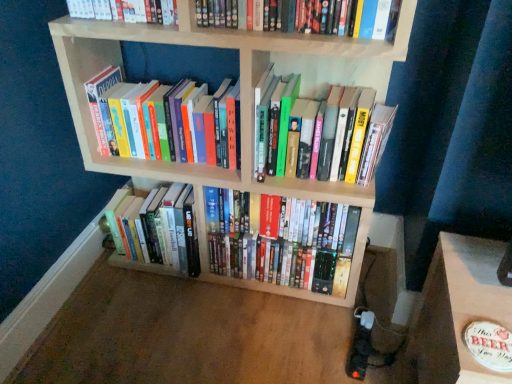
Question: Is hardcover books at left, the 2th book when ordered from top to bottom, inside the boundaries of hardcover book at upper center, placed as the 5th book when sorted from bottom to top, or outside?

Choices:
 (A) inside
 (B) outside

Answer: (B)

Question: In the image, is hardcover books at left, the 2th book when ordered from top to bottom, on the left side or the right side of hardcover book at upper center, the first book when ordered from top to bottom?

Choices:
 (A) right
 (B) left

Answer: (A)

Question: Estimate the real-world distances between objects in this image. Which object is farther from the light wood bookcase at center?

Choices:
 (A) hardcover books at center, the 3th book from the top
 (B) hardcover books at center, the 2th book ordered from the bottom
 (C) hardcover books at left, the 2th book when ordered from top to bottom
 (D) shiny plastic dvds at center, the 1th book positioned from the bottom
 (E) hardcover book at upper center, placed as the 5th book when sorted from bottom to top

Answer: (E)

Question: Estimate the real-world distances between objects in this image. Which object is farther from the light wood bookcase at center?

Choices:
 (A) hardcover books at center, which is counted as the 4th book, starting from the top
 (B) hardcover books at left, the 2th book when ordered from top to bottom
 (C) hardcover book at upper center, placed as the 5th book when sorted from bottom to top
 (D) hardcover books at center, the 3th book from the top
 (E) shiny plastic dvds at center, placed as the 5th book when sorted from top to bottom

Answer: (C)